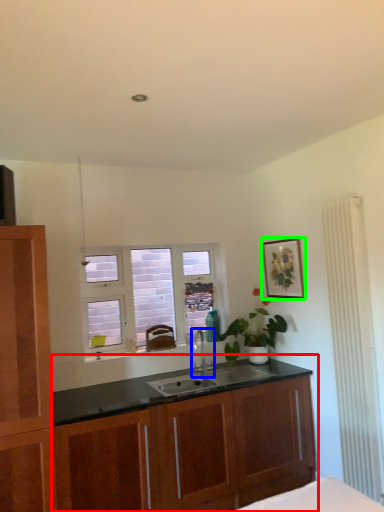
Question: Considering the real-world distances, which object is closest to cabinetry (highlighted by a red box)? tap (highlighted by a blue box) or picture frame (highlighted by a green box).

Choices:
 (A) tap
 (B) picture frame

Answer: (A)